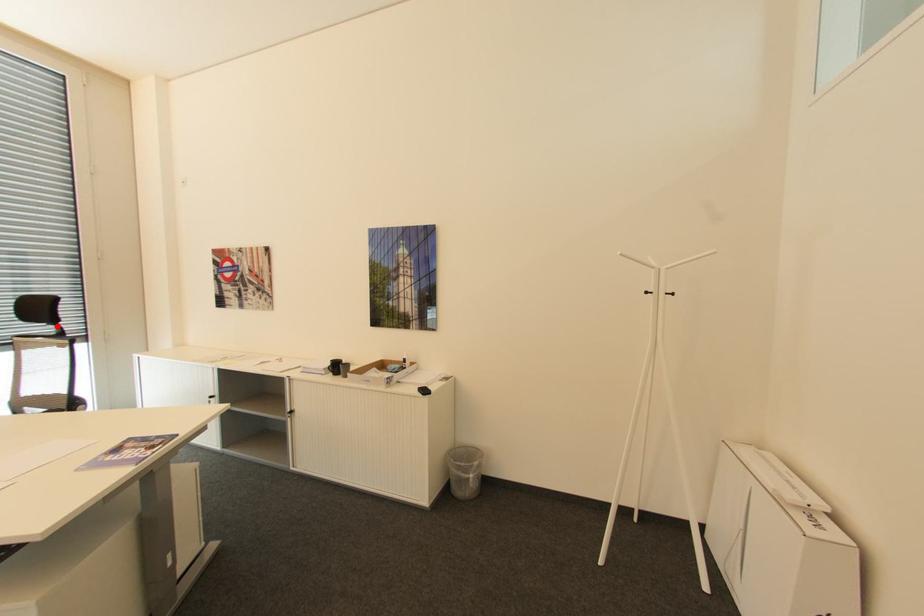
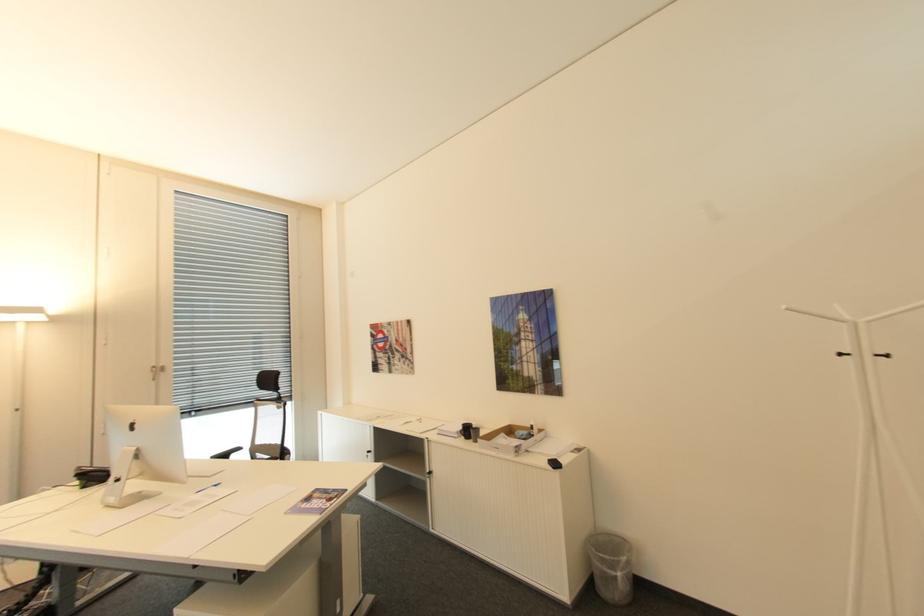
Find the pixel in the second image that matches the highlighted location in the first image.

(280, 392)